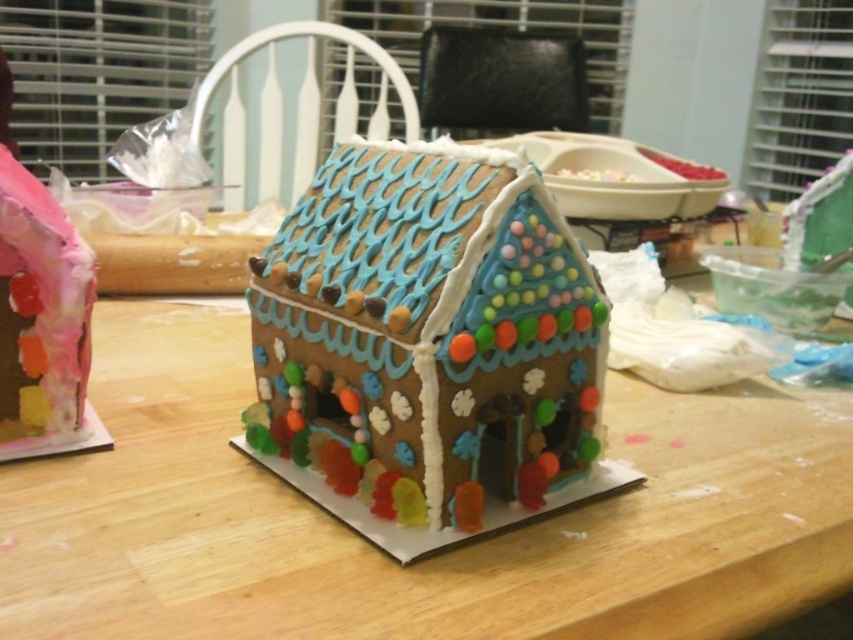
Does wooden table at center appear over glossy gingerbread house at center?

Actually, wooden table at center is below glossy gingerbread house at center.

Measure the distance from wooden table at center to glossy gingerbread house at center.

They are 5.81 inches apart.

Does point (747, 403) lie in front of point (447, 406)?

No, it is behind (447, 406).

You are a GUI agent. You are given a task and a screenshot of the screen. Output one action in this format:
    pyautogui.click(x=<x>, y=<y>)
    Task: Click on the wooden table at center
    Image resolution: width=853 pixels, height=640 pixels.
    Given the screenshot: What is the action you would take?
    pyautogui.click(x=427, y=557)